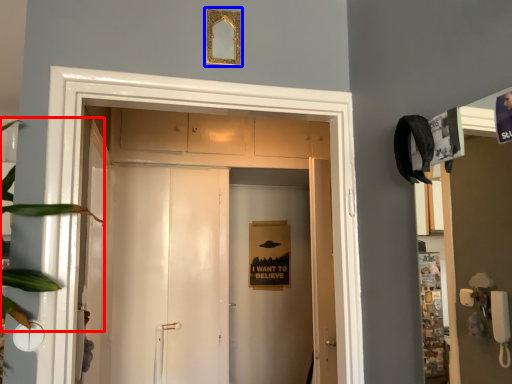
Question: Which of the following is the farthest to the observer, plant (highlighted by a red box) or picture frame (highlighted by a blue box)?

Choices:
 (A) plant
 (B) picture frame

Answer: (B)